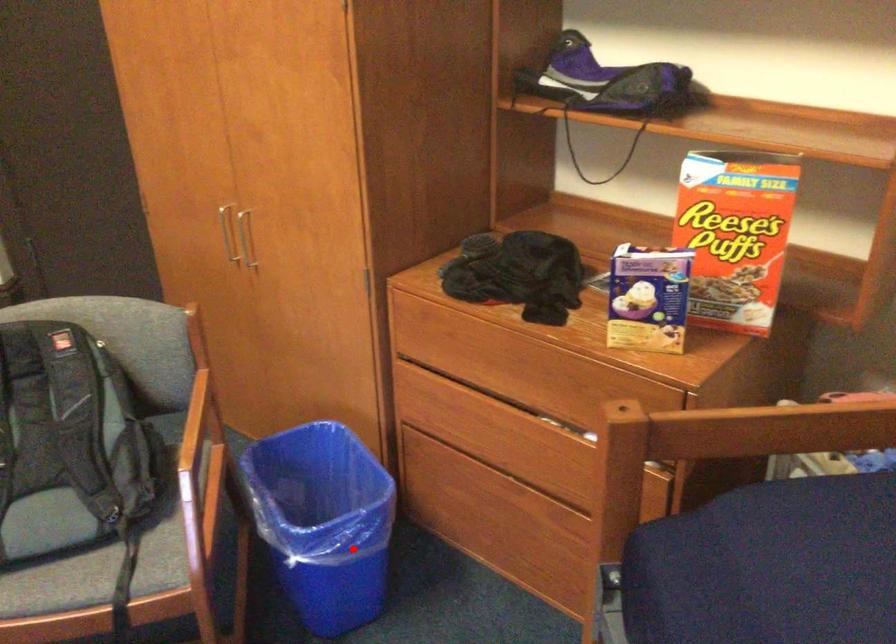
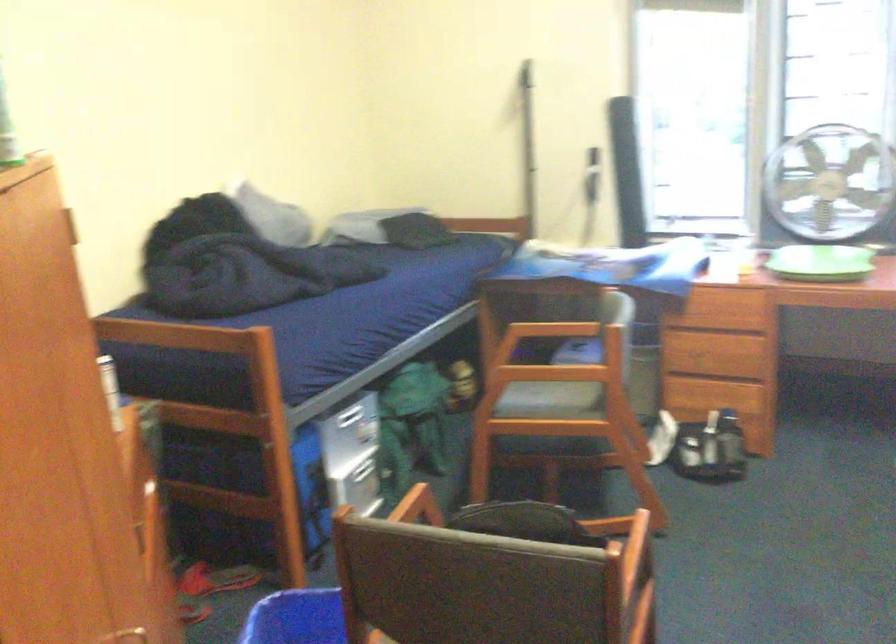
Question: I am providing you with two images of the same scene from different viewpoints. Given a red point in image1, look at the same physical point in image2. Is it:

Choices:
 (A) Closer to the viewpoint
 (B) Farther from the viewpoint

Answer: (B)